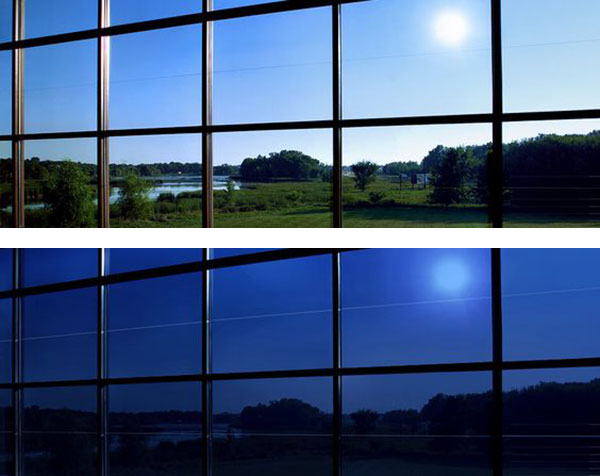
Identify the location of horizontal window frame bars. The image size is (600, 476). (125, 274), (136, 378).